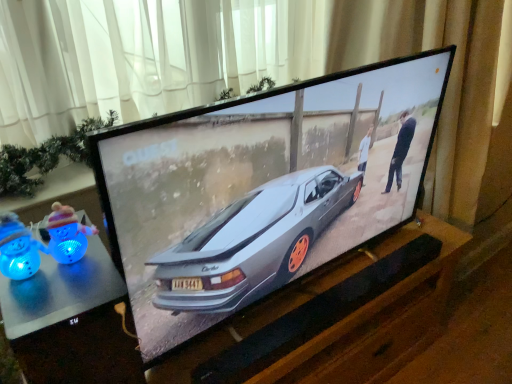
What do you see at coordinates (262, 189) in the screenshot? I see `satin silver car at center` at bounding box center [262, 189].

You are a GUI agent. You are given a task and a screenshot of the screen. Output one action in this format:
    pyautogui.click(x=<x>, y=<y>)
    Task: Click on the metallic silver table at lower left
    The width and height of the screenshot is (512, 384).
    Given the screenshot: What is the action you would take?
    pyautogui.click(x=70, y=322)

Consider the image. Is metallic silver table at lower left not close to blue plastic toy at lower left, marked as the 1th toy in a left-to-right arrangement?

metallic silver table at lower left is near blue plastic toy at lower left, marked as the 1th toy in a left-to-right arrangement, not far away.

Could you tell me if metallic silver table at lower left is turned towards blue plastic toy at lower left, which is counted as the second toy, starting from the right?

No, metallic silver table at lower left is not facing towards blue plastic toy at lower left, which is counted as the second toy, starting from the right.

The image size is (512, 384). What are the coordinates of `the 2nd toy located above the metallic silver table at lower left (from a real-world perspective)` in the screenshot? It's located at (18, 248).

Which is in front, metallic silver table at lower left or blue plastic toy at lower left, marked as the 1th toy in a left-to-right arrangement?

metallic silver table at lower left.

In terms of size, does white sheer curtain at upper center appear bigger or smaller than satin silver car at center?

white sheer curtain at upper center is smaller than satin silver car at center.

Is white sheer curtain at upper center positioned in front of satin silver car at center?

No, the depth of white sheer curtain at upper center is greater than that of satin silver car at center.

From the image's perspective, is white sheer curtain at upper center positioned above or below satin silver car at center?

Based on their image positions, white sheer curtain at upper center is located above satin silver car at center.

Is white sheer curtain at upper center facing away from satin silver car at center?

No.

Based on the photo, in terms of width, does blue plastic toy at left, the first toy from the right, look wider or thinner when compared to metallic silver table at lower left?

In the image, blue plastic toy at left, the first toy from the right, appears to be more narrow than metallic silver table at lower left.

Does point (39, 265) come farther from viewer compared to point (48, 301)?

Yes, point (39, 265) is behind point (48, 301).

Can you confirm if blue plastic toy at left, positioned as the 2th toy in left-to-right order, is taller than metallic silver table at lower left?

No.

Image resolution: width=512 pixels, height=384 pixels. In order to click on toy on the right of metallic silver table at lower left in this screenshot , I will do `click(42, 241)`.

Looking at the image, does blue plastic toy at left, positioned as the 2th toy in left-to-right order, seem bigger or smaller compared to white sheer curtain at upper center?

Considering their sizes, blue plastic toy at left, positioned as the 2th toy in left-to-right order, takes up less space than white sheer curtain at upper center.

Is blue plastic toy at left, positioned as the 2th toy in left-to-right order, oriented towards white sheer curtain at upper center?

No, blue plastic toy at left, positioned as the 2th toy in left-to-right order, is not turned towards white sheer curtain at upper center.

Is the depth of blue plastic toy at left, the first toy from the right, greater than that of white sheer curtain at upper center?

No, the depth of blue plastic toy at left, the first toy from the right, is less than that of white sheer curtain at upper center.

Is point (13, 218) closer or farther from the camera than point (42, 30)?

Clearly, point (13, 218) is closer to the camera than point (42, 30).

In terms of size, does blue plastic toy at left, the first toy from the right, appear bigger or smaller than blue plastic toy at lower left, which is counted as the second toy, starting from the right?

Considering their sizes, blue plastic toy at left, the first toy from the right, takes up more space than blue plastic toy at lower left, which is counted as the second toy, starting from the right.

Considering the sizes of objects blue plastic toy at left, the first toy from the right, and blue plastic toy at lower left, which is counted as the second toy, starting from the right, in the image provided, who is wider, blue plastic toy at left, the first toy from the right, or blue plastic toy at lower left, which is counted as the second toy, starting from the right,?

Wider between the two is blue plastic toy at lower left, which is counted as the second toy, starting from the right.

Considering the sizes of objects blue plastic toy at left, positioned as the 2th toy in left-to-right order, and blue plastic toy at lower left, marked as the 1th toy in a left-to-right arrangement, in the image provided, who is shorter, blue plastic toy at left, positioned as the 2th toy in left-to-right order, or blue plastic toy at lower left, marked as the 1th toy in a left-to-right arrangement,?

blue plastic toy at lower left, marked as the 1th toy in a left-to-right arrangement, is shorter.

I want to click on toy that appears below the blue plastic toy at left, positioned as the 2th toy in left-to-right order (from the image's perspective), so click(x=18, y=248).

Which object is wider, satin silver car at center or blue plastic toy at lower left, which is counted as the second toy, starting from the right?

With larger width is satin silver car at center.

Is blue plastic toy at lower left, marked as the 1th toy in a left-to-right arrangement, completely or partially inside satin silver car at center?

That's incorrect, blue plastic toy at lower left, marked as the 1th toy in a left-to-right arrangement, is not inside satin silver car at center.

Is satin silver car at center to the left of blue plastic toy at lower left, marked as the 1th toy in a left-to-right arrangement, from the viewer's perspective?

No.

Does blue plastic toy at lower left, marked as the 1th toy in a left-to-right arrangement, appear on the right side of blue plastic toy at left, the first toy from the right?

In fact, blue plastic toy at lower left, marked as the 1th toy in a left-to-right arrangement, is to the left of blue plastic toy at left, the first toy from the right.

Which is correct: blue plastic toy at lower left, marked as the 1th toy in a left-to-right arrangement, is inside blue plastic toy at left, positioned as the 2th toy in left-to-right order, or outside of it?

The correct answer is: outside.

Between blue plastic toy at lower left, marked as the 1th toy in a left-to-right arrangement, and blue plastic toy at left, the first toy from the right, which one has larger width?

blue plastic toy at lower left, marked as the 1th toy in a left-to-right arrangement, is wider.

From a real-world perspective, starting from the metallic silver table at lower left, which toy is the 2nd one vertically above it? Please provide its 2D coordinates.

[(18, 248)]

Identify the location of television below the white sheer curtain at upper center (from the image's perspective). The width and height of the screenshot is (512, 384). (262, 189).

Considering their positions, is blue plastic toy at left, positioned as the 2th toy in left-to-right order, positioned closer to metallic silver table at lower left than blue plastic toy at lower left, marked as the 1th toy in a left-to-right arrangement?

blue plastic toy at left, positioned as the 2th toy in left-to-right order.

Looking at this image, looking at the image, which one is located further to blue plastic toy at lower left, marked as the 1th toy in a left-to-right arrangement, blue plastic toy at left, the first toy from the right, or metallic silver table at lower left?

metallic silver table at lower left is further to blue plastic toy at lower left, marked as the 1th toy in a left-to-right arrangement.

Considering their positions, is white sheer curtain at upper center positioned further to metallic silver table at lower left than blue plastic toy at left, positioned as the 2th toy in left-to-right order?

white sheer curtain at upper center is further to metallic silver table at lower left.

When comparing their distances from white sheer curtain at upper center, does blue plastic toy at left, the first toy from the right, or blue plastic toy at lower left, which is counted as the second toy, starting from the right, seem further?

blue plastic toy at lower left, which is counted as the second toy, starting from the right, is positioned further to the anchor white sheer curtain at upper center.

Based on their spatial positions, is satin silver car at center or metallic silver table at lower left further from blue plastic toy at lower left, which is counted as the second toy, starting from the right?

satin silver car at center.

Considering their positions, is metallic silver table at lower left positioned closer to white sheer curtain at upper center than blue plastic toy at left, the first toy from the right?

metallic silver table at lower left.

Looking at the image, which one is located closer to white sheer curtain at upper center, blue plastic toy at lower left, marked as the 1th toy in a left-to-right arrangement, or blue plastic toy at left, the first toy from the right?

blue plastic toy at left, the first toy from the right, lies closer to white sheer curtain at upper center than the other object.

Estimate the real-world distances between objects in this image. Which object is closer to blue plastic toy at left, positioned as the 2th toy in left-to-right order, metallic silver table at lower left or satin silver car at center?

metallic silver table at lower left is closer to blue plastic toy at left, positioned as the 2th toy in left-to-right order.

Locate an element on the screen. This screenshot has height=384, width=512. toy between metallic silver table at lower left and satin silver car at center in the horizontal direction is located at coordinates (42, 241).

Find the location of a particular element. toy between blue plastic toy at left, positioned as the 2th toy in left-to-right order, and metallic silver table at lower left in the up-down direction is located at coordinates (18, 248).

This screenshot has width=512, height=384. In order to click on curtain located between blue plastic toy at lower left, marked as the 1th toy in a left-to-right arrangement, and satin silver car at center in the left-right direction in this screenshot , I will do `click(268, 70)`.

I want to click on table between blue plastic toy at lower left, which is counted as the second toy, starting from the right, and satin silver car at center, so click(x=70, y=322).